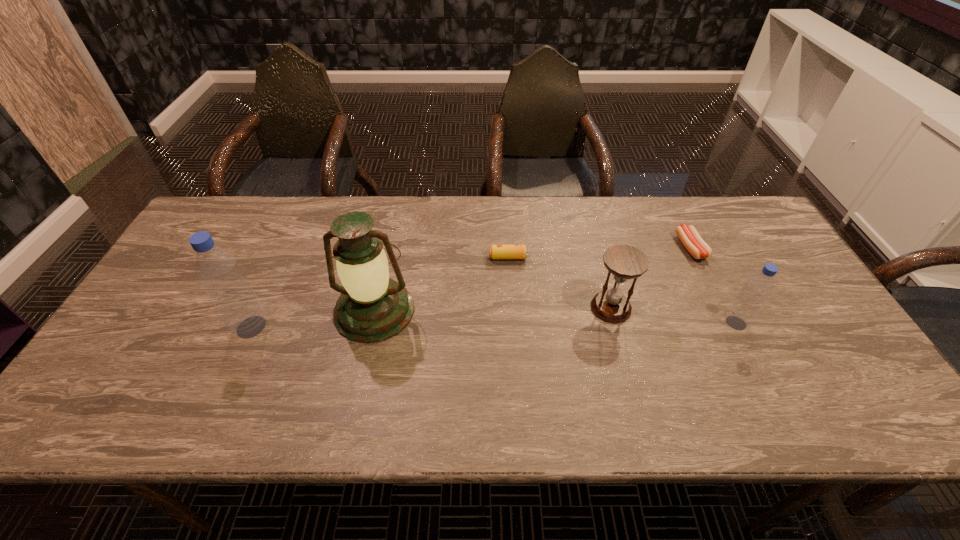
Please determine a free point for an extra bottle to ensure balance. Please provide its 2D coordinates. Your answer should be formatted as a tuple, i.e. [(x, y)], where the tuple contains the x and y coordinates of a point satisfying the conditions above.

[(494, 325)]